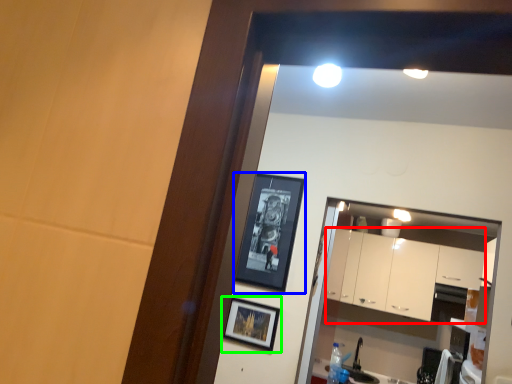
Question: Which object is the farthest from cabinetry (highlighted by a red box)? Choose among these: picture frame (highlighted by a blue box) or picture frame (highlighted by a green box).

Choices:
 (A) picture frame
 (B) picture frame

Answer: (B)